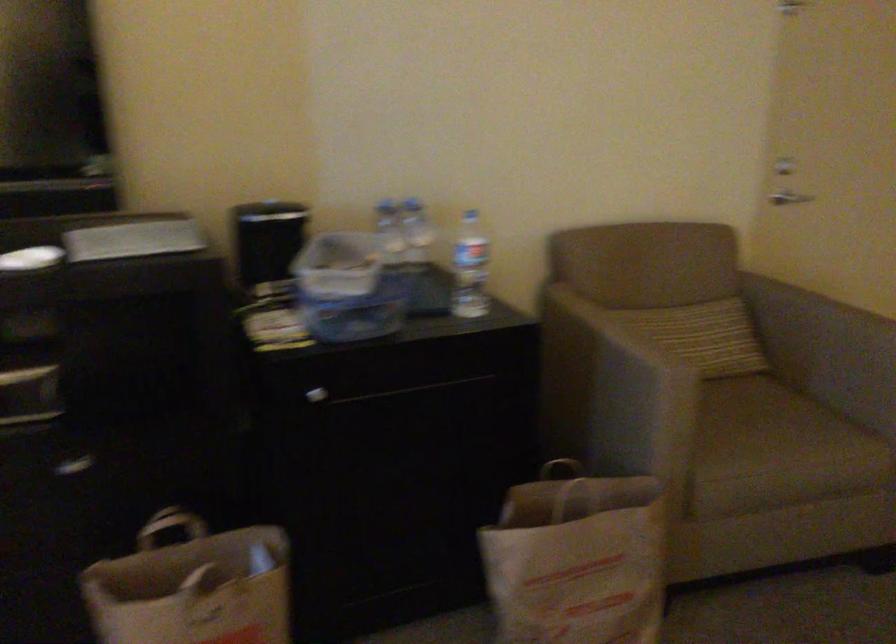
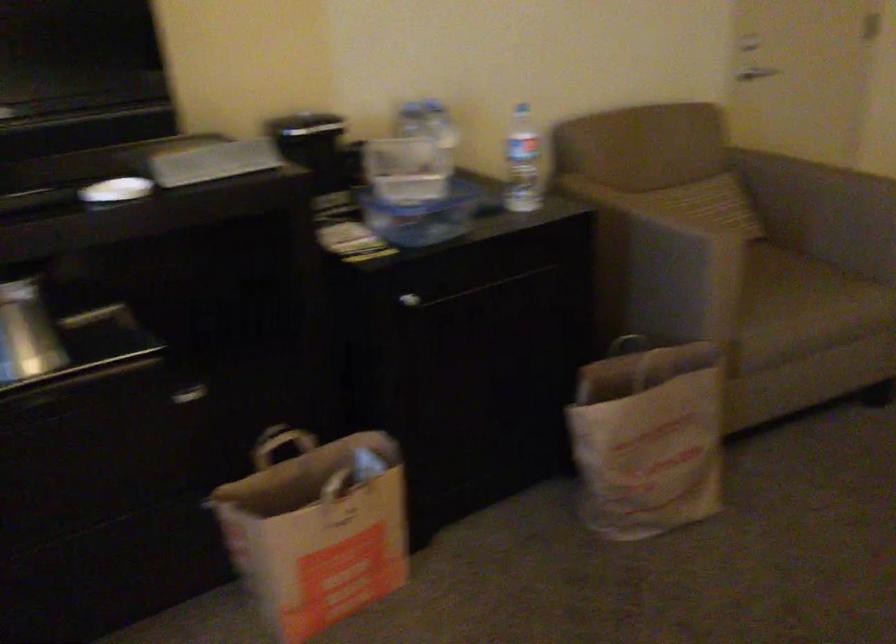
Question: Based on the continuous images, in which direction is the camera rotating? Reply with the corresponding letter.

Choices:
 (A) Left
 (B) Right
 (C) Up
 (D) Down

Answer: (D)